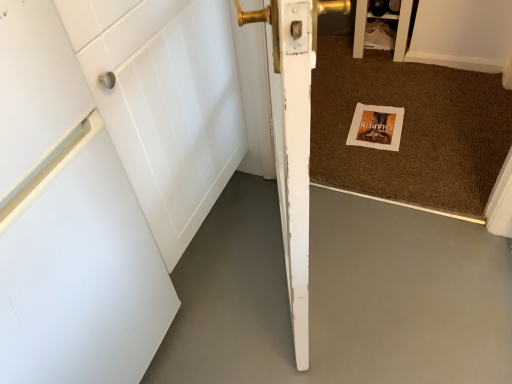
The height and width of the screenshot is (384, 512). I want to click on vacant area that lies between matte white cabinet at upper right and white paper postcard at center, so (x=376, y=84).